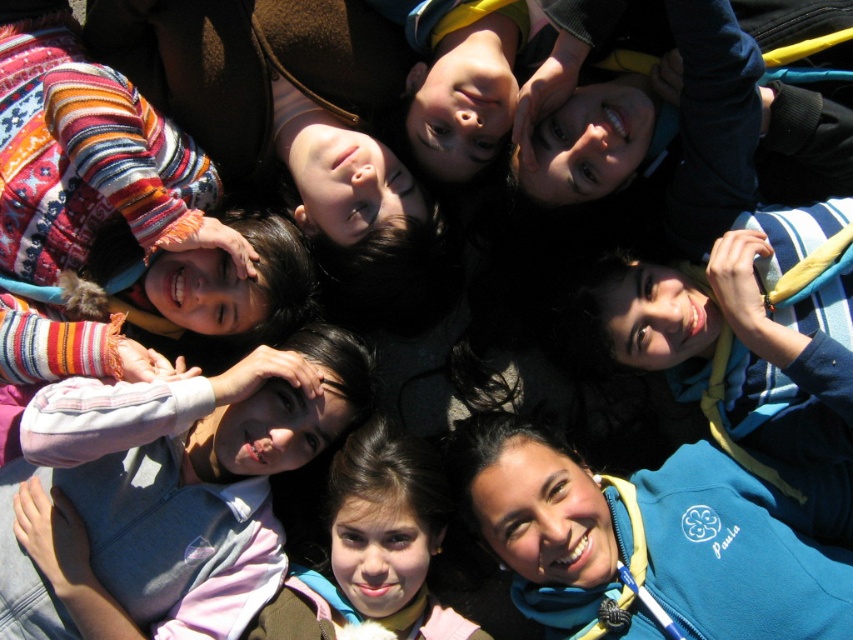
Question: Can you confirm if light blue denim jacket at center is wider than brown hair at center?

Choices:
 (A) yes
 (B) no

Answer: (A)

Question: Which point appears farthest from the camera in this image?

Choices:
 (A) (244, 573)
 (B) (409, 605)

Answer: (B)

Question: Is light blue denim jacket at center positioned in front of brown hair at center?

Choices:
 (A) yes
 (B) no

Answer: (A)

Question: Which point is closer to the camera?

Choices:
 (A) light blue denim jacket at center
 (B) brown hair at center

Answer: (A)

Question: Does light blue denim jacket at center lie behind brown hair at center?

Choices:
 (A) no
 (B) yes

Answer: (A)